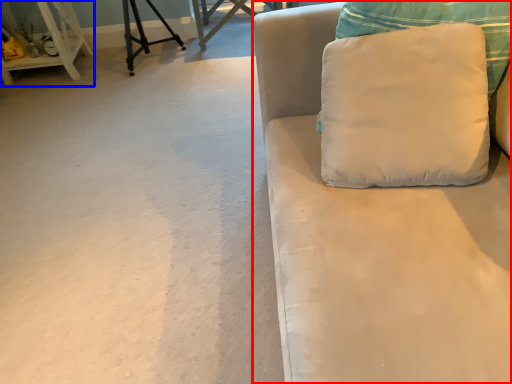
Question: Which point is further to the camera, studio couch (highlighted by a red box) or furniture (highlighted by a blue box)?

Choices:
 (A) studio couch
 (B) furniture

Answer: (B)